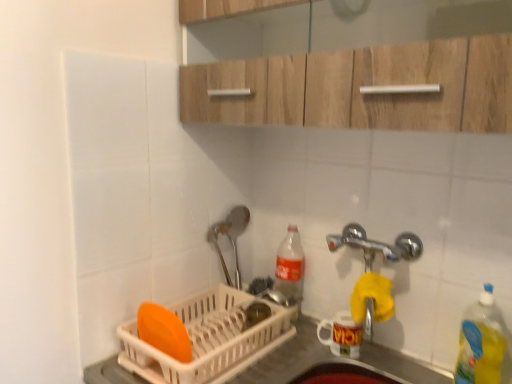
Question: Looking at their shapes, would you say yellow translucent bottle at right, the first bottle positioned from the right, is wider or thinner than white plastic dish rack at lower left?

Choices:
 (A) wide
 (B) thin

Answer: (B)

Question: Would you say yellow translucent bottle at right, the 2th bottle positioned from the left, is to the left or to the right of white plastic dish rack at lower left in the picture?

Choices:
 (A) right
 (B) left

Answer: (A)

Question: Estimate the real-world distances between objects in this image. Which object is closer to the wooden cabinet at upper center?

Choices:
 (A) yellow translucent bottle at right, placed as the 2th bottle when sorted from back to front
 (B) white plastic dish rack at lower left
 (C) translucent plastic bottle at center, the 1th bottle viewed from the left
 (D) white plastic dish rack at lower left

Answer: (C)

Question: Which object is the farthest from the yellow translucent bottle at right, the first bottle positioned from the right?

Choices:
 (A) white plastic dish rack at lower left
 (B) white plastic dish rack at lower left
 (C) translucent plastic bottle at center, the second bottle from the front
 (D) wooden cabinet at upper center

Answer: (D)